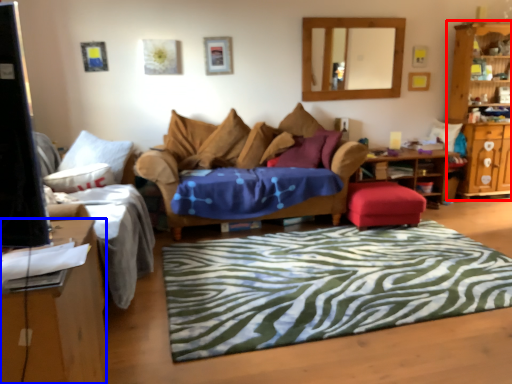
Question: Which object is further to the camera taking this photo, cabinetry (highlighted by a red box) or desk (highlighted by a blue box)?

Choices:
 (A) cabinetry
 (B) desk

Answer: (A)